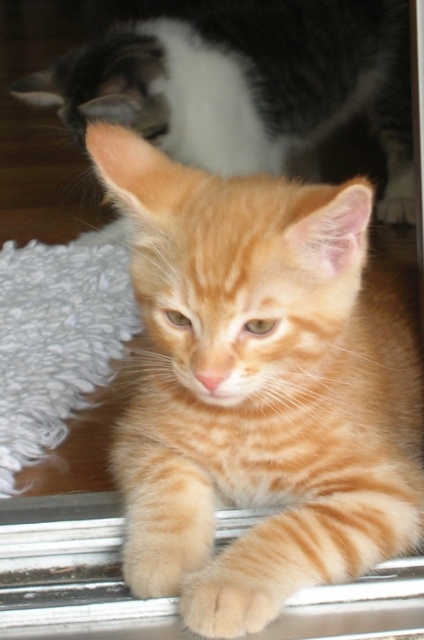
Is point (231, 195) in front of point (150, 45)?

Yes, it is.

Is point (365, 396) closer to viewer compared to point (209, 80)?

Yes, it is in front of point (209, 80).

I want to click on orange striped kitten at center, so (261, 374).

Is the position of orange striped kitten at center less distant than that of soft orange fur paw at lower center?

Yes, orange striped kitten at center is closer to the viewer.

Does point (245, 320) lie behind point (256, 572)?

No, (245, 320) is in front of (256, 572).

Image resolution: width=424 pixels, height=640 pixels. Identify the location of orange striped kitten at center. tap(261, 374).

Is metallic silver window sill at lower center further to camera compared to soft orange fur paw at lower center?

Yes, metallic silver window sill at lower center is behind soft orange fur paw at lower center.

Based on the photo, can you confirm if metallic silver window sill at lower center is shorter than soft orange fur paw at lower center?

No.

Does point (223, 536) come farther from viewer compared to point (234, 605)?

That is True.

Locate an element on the screen. The image size is (424, 640). metallic silver window sill at lower center is located at coordinates (72, 573).